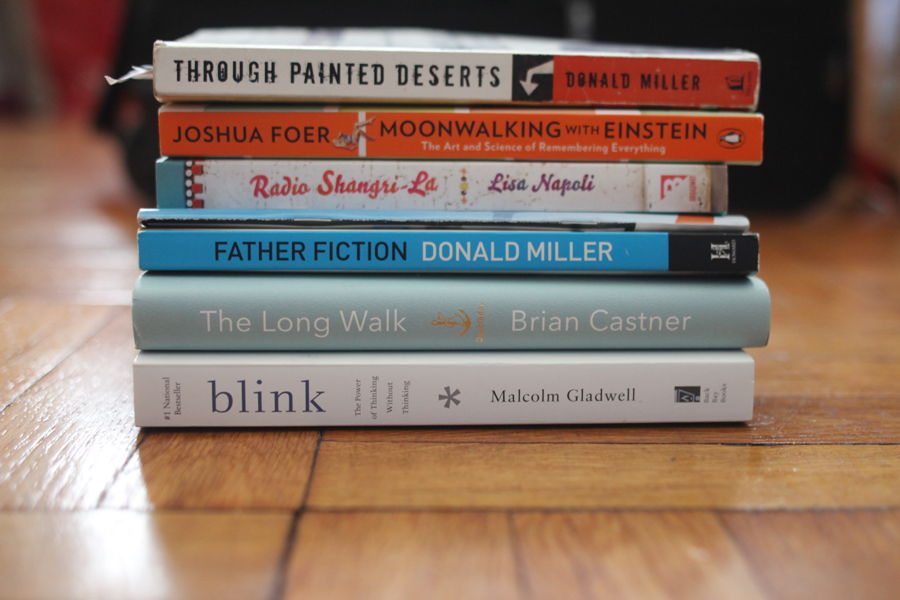
Where is `book`? The height and width of the screenshot is (600, 900). book is located at coordinates (505, 70), (505, 127), (504, 187), (295, 220), (294, 244), (301, 315), (265, 381).